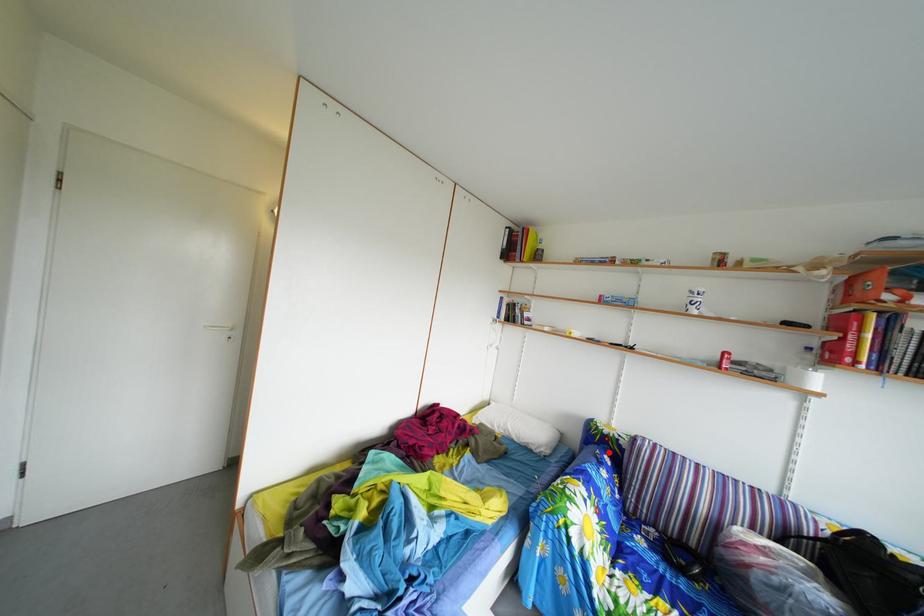
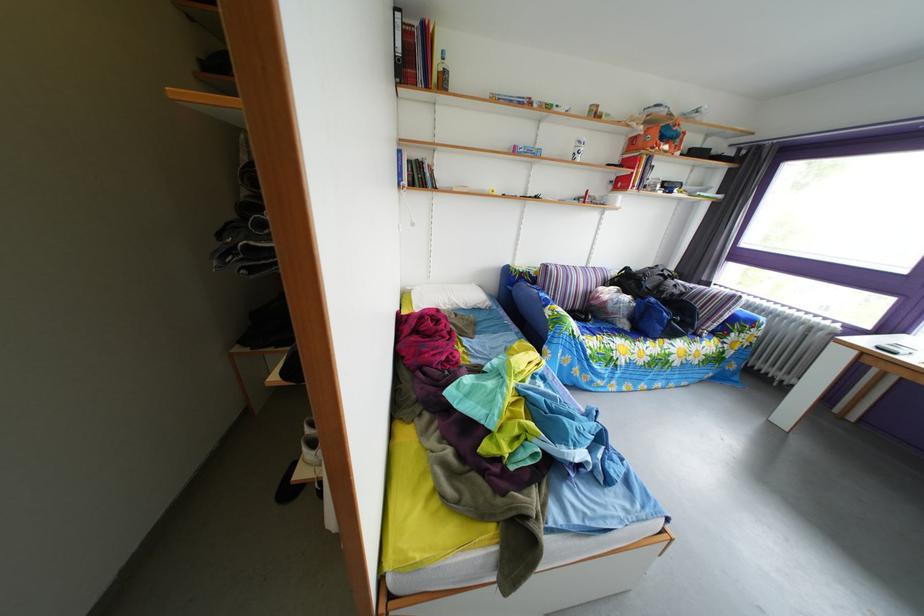
The point at the highlighted location is marked in the first image. Where is the corresponding point in the second image?

(529, 289)